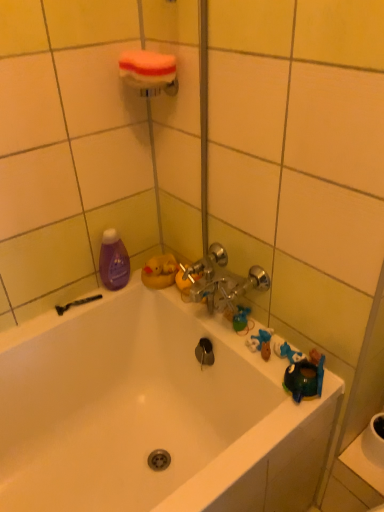
Question: Considering the positions of point (360, 462) and point (107, 285), is point (360, 462) closer or farther from the camera than point (107, 285)?

Choices:
 (A) farther
 (B) closer

Answer: (B)

Question: Is white glossy sink at lower right situated inside purple glossy bottle at left or outside?

Choices:
 (A) outside
 (B) inside

Answer: (A)

Question: Which object is positioned closest to the white glossy sink at lower right?

Choices:
 (A) white foam sponge at upper center
 (B) purple glossy bottle at left
 (C) white glossy bathtub at center

Answer: (C)

Question: Which object is positioned farthest from the purple glossy bottle at left?

Choices:
 (A) white glossy bathtub at center
 (B) white glossy sink at lower right
 (C) white foam sponge at upper center

Answer: (B)